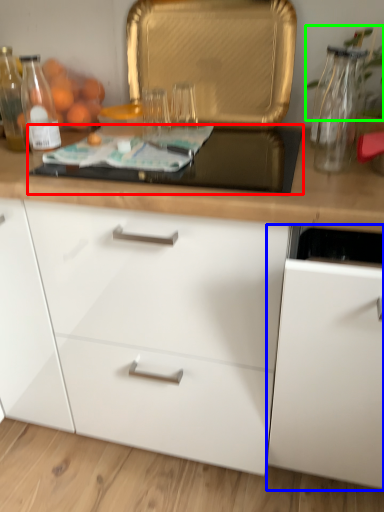
Question: Which is nearer to the gas stove (highlighted by a red box)? cabinetry (highlighted by a blue box) or plant (highlighted by a green box).

Choices:
 (A) cabinetry
 (B) plant

Answer: (B)